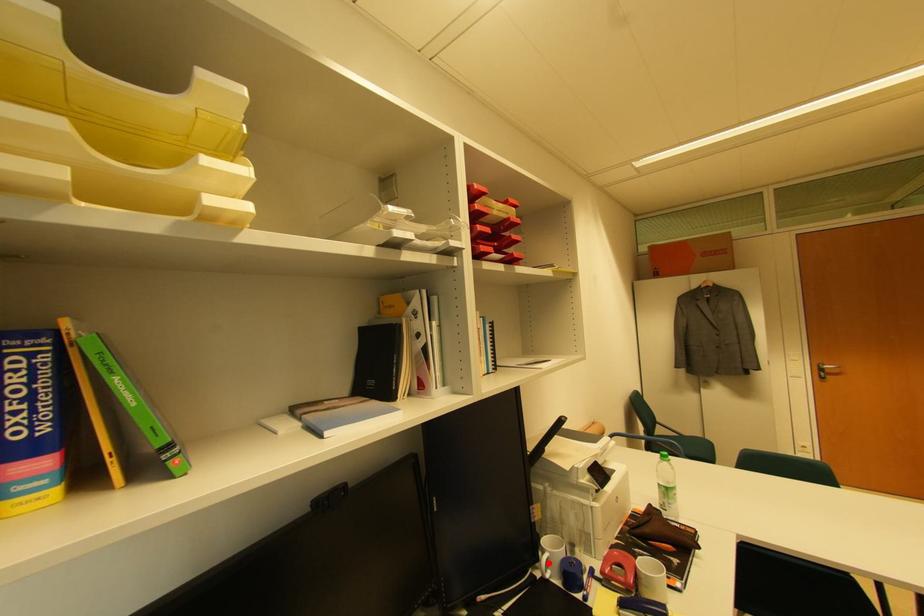
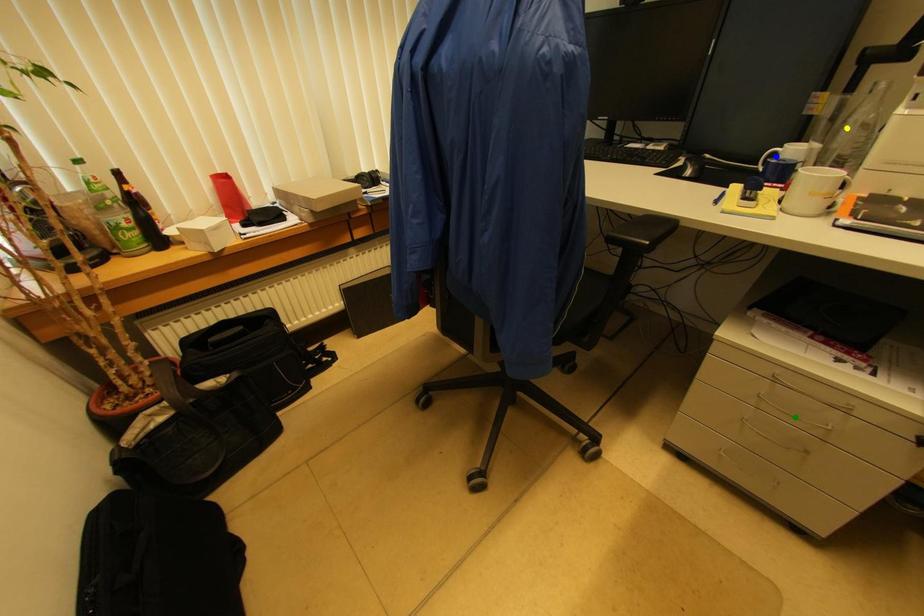
Question: I am providing you with two images of the same scene from different viewpoints. A red point is marked on the first image. You are given multiple points on the second image. Which point in image 2 represents the same 3d spot as the red point in image 1?

Choices:
 (A) yellow point
 (B) green point
 (C) blue point

Answer: (C)